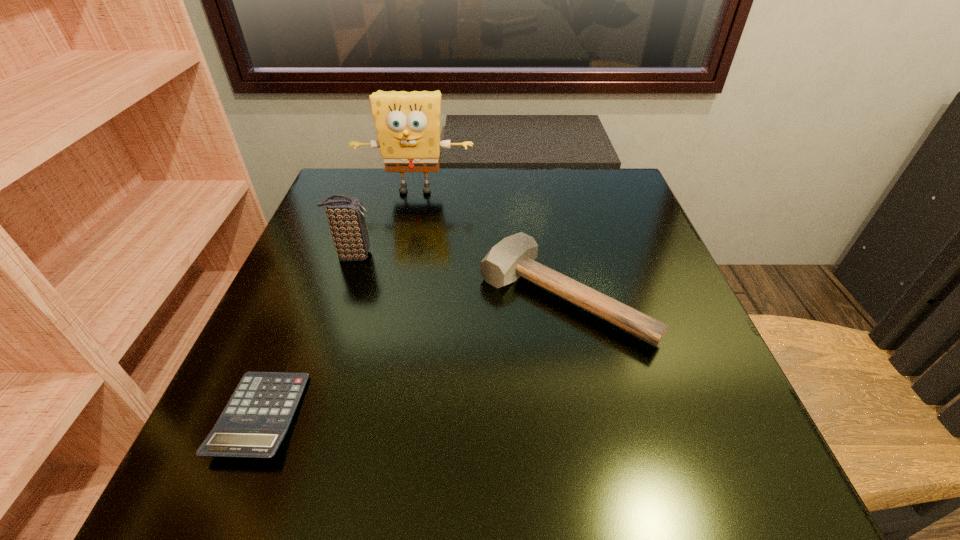
The image size is (960, 540). In order to click on blank space at the near edge of the desktop in this screenshot , I will do `click(527, 449)`.

The width and height of the screenshot is (960, 540). I want to click on blank space at the left edge, so click(285, 327).

Where is `free spot at the right edge of the desktop`? The width and height of the screenshot is (960, 540). free spot at the right edge of the desktop is located at coordinates (678, 285).

In the image, there is a desktop. Identify the location of free space at the far left corner. (348, 174).

I want to click on free region at the near left corner of the desktop, so click(283, 483).

In the image, there is a desktop. Where is `vacant area at the far right corner`? The height and width of the screenshot is (540, 960). vacant area at the far right corner is located at coordinates (596, 215).

Locate an element on the screen. Image resolution: width=960 pixels, height=540 pixels. free space between the third tallest object and the sponge is located at coordinates (490, 243).

This screenshot has width=960, height=540. Find the location of `free area in between the tallest object and the calculator`. free area in between the tallest object and the calculator is located at coordinates (338, 303).

This screenshot has width=960, height=540. I want to click on blank region between the third shortest object and the farthest object, so click(384, 222).

In order to click on empty space that is in between the clutch bag and the mallet in this screenshot , I will do click(x=458, y=276).